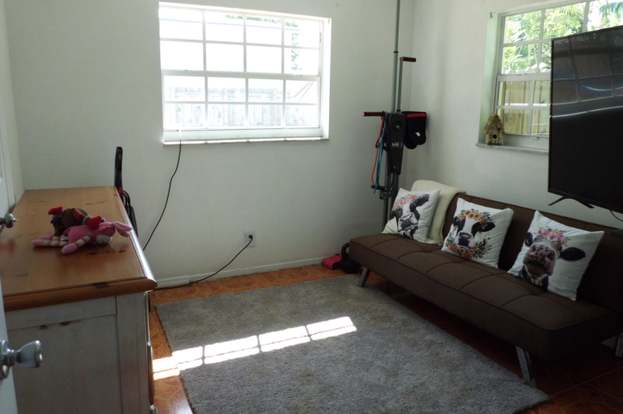
At what (x,y) coordinates should I click in order to perform the action: click on wooden countertop. Please return your answer as a coordinate pair (x, y). The height and width of the screenshot is (414, 623). Looking at the image, I should click on (74, 281).